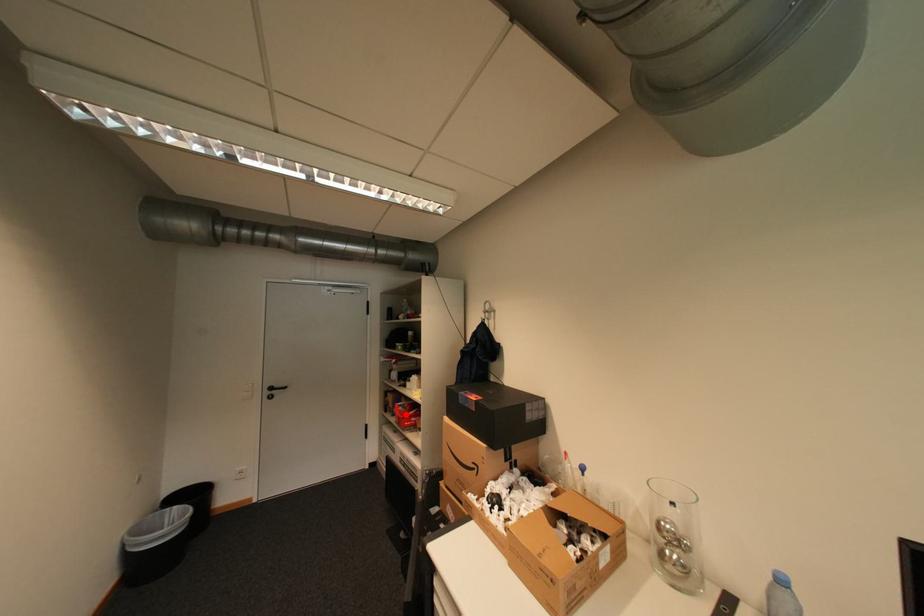
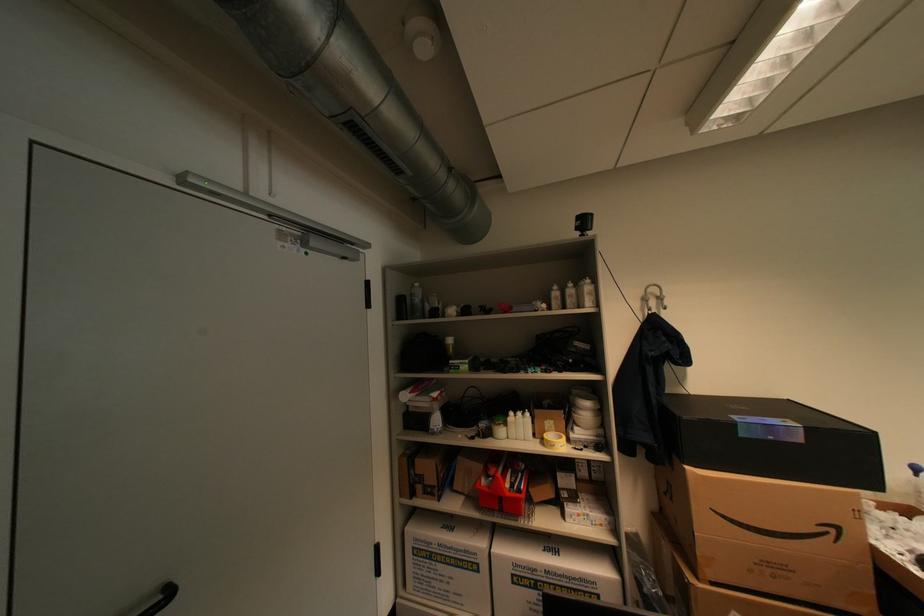
In the second image, find the point that corresponds to the highlighted location in the first image.

(516, 495)